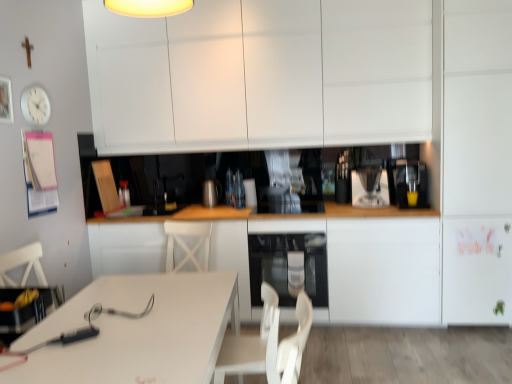
I want to click on free space on the front side of sleek metallic coffee maker at center, the 1th appliance when ordered from right to left, so click(x=376, y=206).